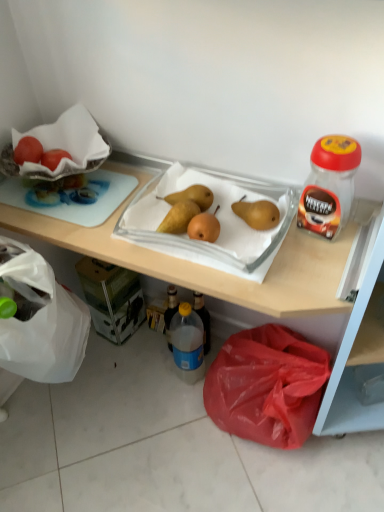
Question: Considering the relative sizes of matte white grapefruit at upper left and red plastic bag at lower center in the image provided, is matte white grapefruit at upper left thinner than red plastic bag at lower center?

Choices:
 (A) no
 (B) yes

Answer: (B)

Question: Does matte white grapefruit at upper left have a greater height compared to red plastic bag at lower center?

Choices:
 (A) no
 (B) yes

Answer: (A)

Question: Considering the relative sizes of matte white grapefruit at upper left and red plastic bag at lower center in the image provided, is matte white grapefruit at upper left bigger than red plastic bag at lower center?

Choices:
 (A) no
 (B) yes

Answer: (A)

Question: Could red plastic bag at lower center be considered to be inside matte white grapefruit at upper left?

Choices:
 (A) yes
 (B) no

Answer: (B)

Question: Is matte white grapefruit at upper left beside red plastic bag at lower center?

Choices:
 (A) no
 (B) yes

Answer: (A)

Question: From the image's perspective, relative to translucent plastic jar at right, is translucent plastic bottle at lower center above or below?

Choices:
 (A) below
 (B) above

Answer: (A)

Question: Is translucent plastic bottle at lower center in front of or behind translucent plastic jar at right in the image?

Choices:
 (A) front
 (B) behind

Answer: (B)

Question: Considering the positions of translucent plastic bottle at lower center and translucent plastic jar at right in the image, is translucent plastic bottle at lower center bigger or smaller than translucent plastic jar at right?

Choices:
 (A) big
 (B) small

Answer: (A)

Question: Considering the positions of point (175, 348) and point (332, 230), is point (175, 348) closer or farther from the camera than point (332, 230)?

Choices:
 (A) farther
 (B) closer

Answer: (A)

Question: Considering the positions of translucent plastic bottle at lower center and smooth brown pears at center in the image, is translucent plastic bottle at lower center taller or shorter than smooth brown pears at center?

Choices:
 (A) tall
 (B) short

Answer: (A)

Question: Is translucent plastic bottle at lower center to the left or to the right of smooth brown pears at center in the image?

Choices:
 (A) left
 (B) right

Answer: (A)

Question: In the image, is translucent plastic bottle at lower center positioned in front of or behind smooth brown pears at center?

Choices:
 (A) behind
 (B) front

Answer: (A)

Question: Is translucent plastic bottle at lower center inside or outside of smooth brown pears at center?

Choices:
 (A) outside
 (B) inside

Answer: (A)

Question: Is translucent plastic jar at right in front of or behind wooden tray at upper center in the image?

Choices:
 (A) front
 (B) behind

Answer: (B)

Question: Based on their positions, is translucent plastic jar at right located to the left or right of wooden tray at upper center?

Choices:
 (A) left
 (B) right

Answer: (B)